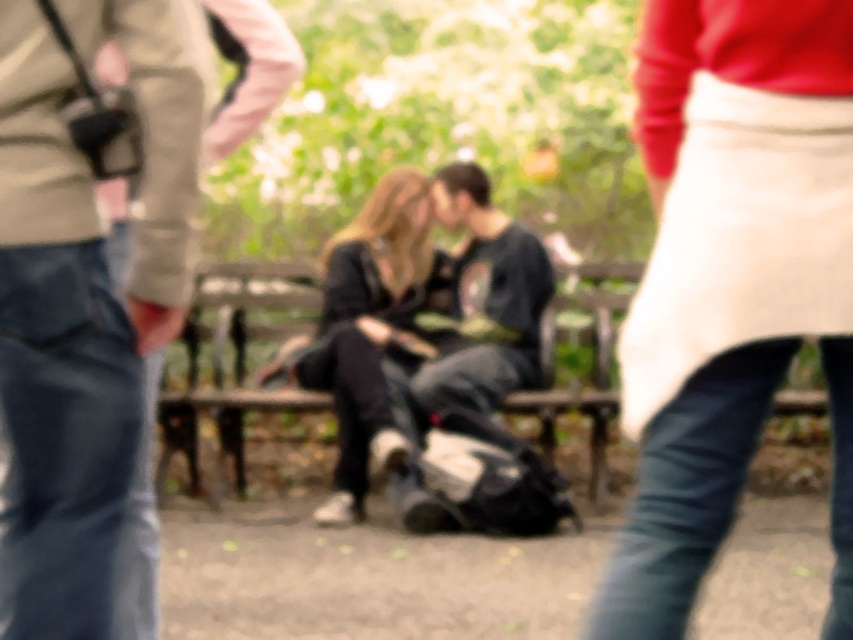
You are a photographer trying to capture a clear shot of the matte black backpack at center and the black matte jacket at center in the park scene. Since the backpack is shorter than the jacket, which object should you focus on first to ensure both are in frame?

The matte black backpack at center is shorter than the black matte jacket at center. To ensure both are in frame, focus on the taller object first, which is the black matte jacket at center.